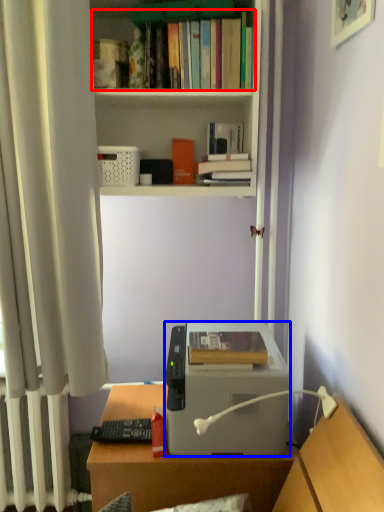
Question: Which point is closer to the camera, book (highlighted by a red box) or printer (highlighted by a blue box)?

Choices:
 (A) book
 (B) printer

Answer: (B)